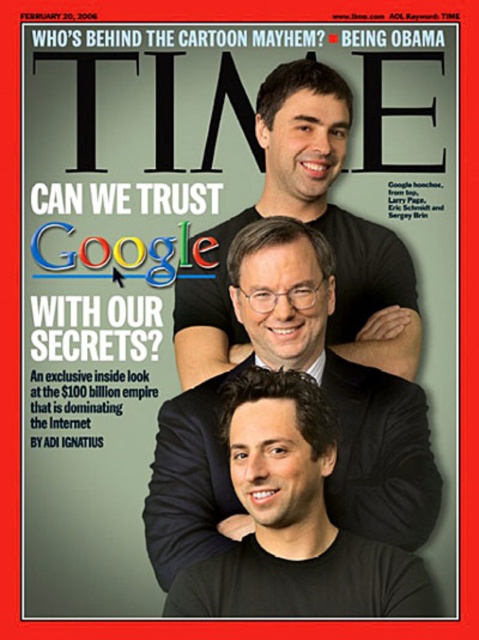
Question: Does matte black suit at center appear on the right side of black matte shirt at center?

Choices:
 (A) yes
 (B) no

Answer: (B)

Question: Which point is farther to the camera?

Choices:
 (A) matte black suit at center
 (B) black matte shirt at center

Answer: (B)

Question: Is matte black suit at center above black matte shirt at center?

Choices:
 (A) yes
 (B) no

Answer: (B)

Question: Which point is closer to the camera?

Choices:
 (A) matte black suit at center
 (B) black matte shirt at center

Answer: (A)

Question: Which object is closer to the camera taking this photo?

Choices:
 (A) black matte shirt at center
 (B) matte black suit at center

Answer: (B)

Question: Is matte black suit at center wider than black matte shirt at center?

Choices:
 (A) no
 (B) yes

Answer: (A)